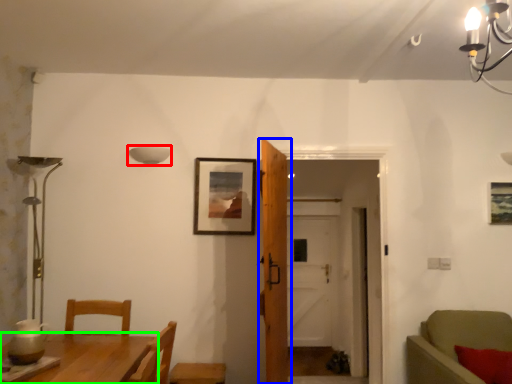
Question: Estimate the real-world distances between objects in this image. Which object is farther from lamp (highlighted by a red box), door (highlighted by a blue box) or table (highlighted by a green box)?

Choices:
 (A) door
 (B) table

Answer: (B)